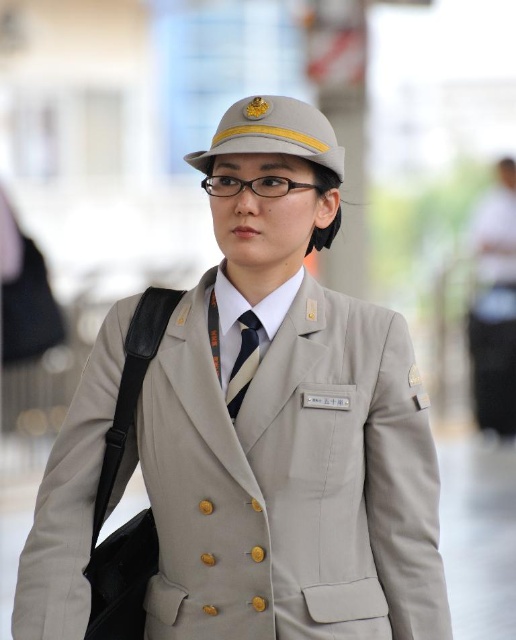
Where is `beige uniform at center`? Image resolution: width=516 pixels, height=640 pixels. beige uniform at center is located at coordinates [285, 420].

Image resolution: width=516 pixels, height=640 pixels. What do you see at coordinates (285, 420) in the screenshot?
I see `beige uniform at center` at bounding box center [285, 420].

Is point (275, 275) closer to camera compared to point (229, 388)?

No, it is behind (229, 388).

Identify the location of beige uniform at center. This screenshot has width=516, height=640. (285, 420).